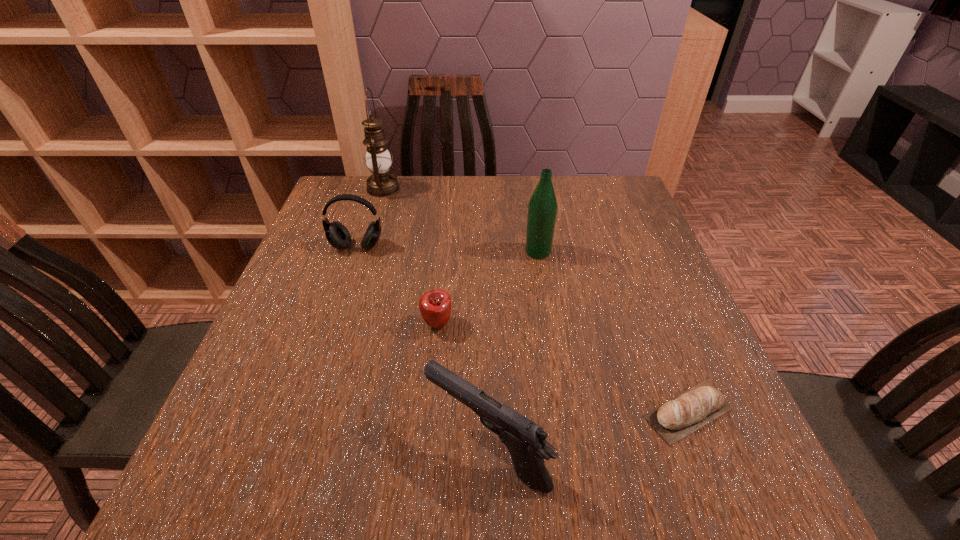
Where is `blank region between the bottle and the headset`? blank region between the bottle and the headset is located at coordinates point(447,249).

Identify the location of free space that is in between the headset and the tallest object. (371, 218).

This screenshot has width=960, height=540. In order to click on free space between the gun and the shortest object in this screenshot , I will do `click(588, 430)`.

The height and width of the screenshot is (540, 960). What are the coordinates of `free spot between the headset and the oil lamp` in the screenshot? It's located at (371, 218).

You are a GUI agent. You are given a task and a screenshot of the screen. Output one action in this format:
    pyautogui.click(x=<x>, y=<y>)
    Task: Click on the vacant area that lies between the gun and the shortest object
    
    Given the screenshot: What is the action you would take?
    (x=588, y=430)

Locate an element on the screen. The image size is (960, 540). vacant area between the bottle and the rightmost object is located at coordinates (613, 332).

The height and width of the screenshot is (540, 960). I want to click on free point between the fifth object from left to right and the rightmost object, so click(x=613, y=332).

The width and height of the screenshot is (960, 540). I want to click on vacant region between the rightmost object and the second shortest object, so click(563, 368).

Where is `free area in between the gun and the shortest object`? free area in between the gun and the shortest object is located at coordinates (588, 430).

Select which object appears as the closest to the oil lamp. Please provide its 2D coordinates. Your answer should be formatted as a tuple, i.e. [(x, y)], where the tuple contains the x and y coordinates of a point satisfying the conditions above.

[(337, 234)]